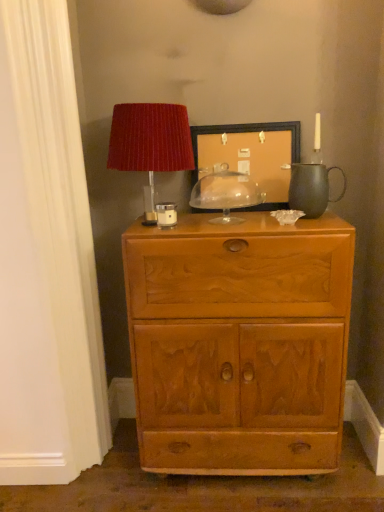
The height and width of the screenshot is (512, 384). What are the coordinates of `free space in front of matte black teapot at right` in the screenshot? It's located at (319, 221).